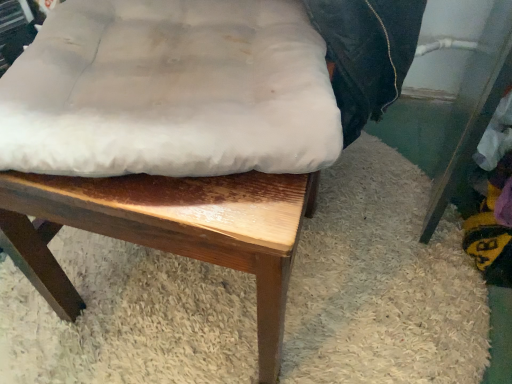
The height and width of the screenshot is (384, 512). What are the coordinates of `white fabric cushion at center` in the screenshot? It's located at (166, 231).

Describe the element at coordinates (166, 231) in the screenshot. I see `white fabric cushion at center` at that location.

The image size is (512, 384). What do you see at coordinates (170, 91) in the screenshot?
I see `white fabric cushion at center` at bounding box center [170, 91].

Locate an element on the screen. white fabric cushion at center is located at coordinates (170, 91).

Identify the location of white fabric cushion at center. (166, 231).

Does white fabric cushion at center appear on the left side of white fabric cushion at center?

Incorrect, white fabric cushion at center is not on the left side of white fabric cushion at center.

Does white fabric cushion at center come in front of white fabric cushion at center?

Yes, it is in front of white fabric cushion at center.

Does point (149, 202) appear closer or farther from the camera than point (149, 163)?

Point (149, 202) appears to be farther away from the viewer than point (149, 163).

From the image's perspective, which one is positioned lower, white fabric cushion at center or white fabric cushion at center?

white fabric cushion at center appears lower in the image.

From a real-world perspective, which object stands above the other?

white fabric cushion at center.

Which object is thinner, white fabric cushion at center or white fabric cushion at center?

white fabric cushion at center is thinner.

Is white fabric cushion at center shorter than white fabric cushion at center?

In fact, white fabric cushion at center may be taller than white fabric cushion at center.

Is white fabric cushion at center bigger or smaller than white fabric cushion at center?

In the image, white fabric cushion at center appears to be larger than white fabric cushion at center.

Is white fabric cushion at center situated inside white fabric cushion at center or outside?

white fabric cushion at center is outside white fabric cushion at center.

Is white fabric cushion at center in contact with white fabric cushion at center?

Absolutely, white fabric cushion at center is next to and touching white fabric cushion at center.

Does white fabric cushion at center turn towards white fabric cushion at center?

Yes, white fabric cushion at center is oriented towards white fabric cushion at center.

How many degrees apart are the facing directions of white fabric cushion at center and white fabric cushion at center?

They differ by 4.51 degrees in their facing directions.

This screenshot has width=512, height=384. What are the coordinates of `sheet to the left of white fabric cushion at center` in the screenshot? It's located at (170, 91).

In the image, is white fabric cushion at center on the left side or the right side of white fabric cushion at center?

white fabric cushion at center is positioned on white fabric cushion at center's left side.

Is white fabric cushion at center behind white fabric cushion at center?

That is True.

Is point (202, 89) positioned after point (271, 329)?

No, it is not.

From the image's perspective, is white fabric cushion at center positioned above or below white fabric cushion at center?

white fabric cushion at center is situated higher than white fabric cushion at center in the image.

From a real-world perspective, who is located lower, white fabric cushion at center or white fabric cushion at center?

white fabric cushion at center.

Can you confirm if white fabric cushion at center is thinner than white fabric cushion at center?

Yes.

Which of these two, white fabric cushion at center or white fabric cushion at center, stands shorter?

With less height is white fabric cushion at center.

Between white fabric cushion at center and white fabric cushion at center, which one has larger size?

Bigger between the two is white fabric cushion at center.

Consider the image. Which is correct: white fabric cushion at center is inside white fabric cushion at center, or outside of it?

white fabric cushion at center is spatially positioned inside white fabric cushion at center.

Can you see white fabric cushion at center touching white fabric cushion at center?

Yes, white fabric cushion at center is right next to white fabric cushion at center and making contact.

Is white fabric cushion at center facing towards white fabric cushion at center?

Yes, white fabric cushion at center faces towards white fabric cushion at center.

How different are the orientations of white fabric cushion at center and white fabric cushion at center in degrees?

They differ by 4.51 degrees in their facing directions.

The image size is (512, 384). In the image, there is a white fabric cushion at center. What are the coordinates of `sheet above it (from the image's perspective)` in the screenshot? It's located at (170, 91).

You are a GUI agent. You are given a task and a screenshot of the screen. Output one action in this format:
    pyautogui.click(x=<x>, y=<y>)
    Task: Click on the chair below the white fabric cushion at center (from the image's perspective)
    This screenshot has height=384, width=512.
    Given the screenshot: What is the action you would take?
    pyautogui.click(x=166, y=231)

What are the coordinates of `chair in front of the white fabric cushion at center` in the screenshot? It's located at (166, 231).